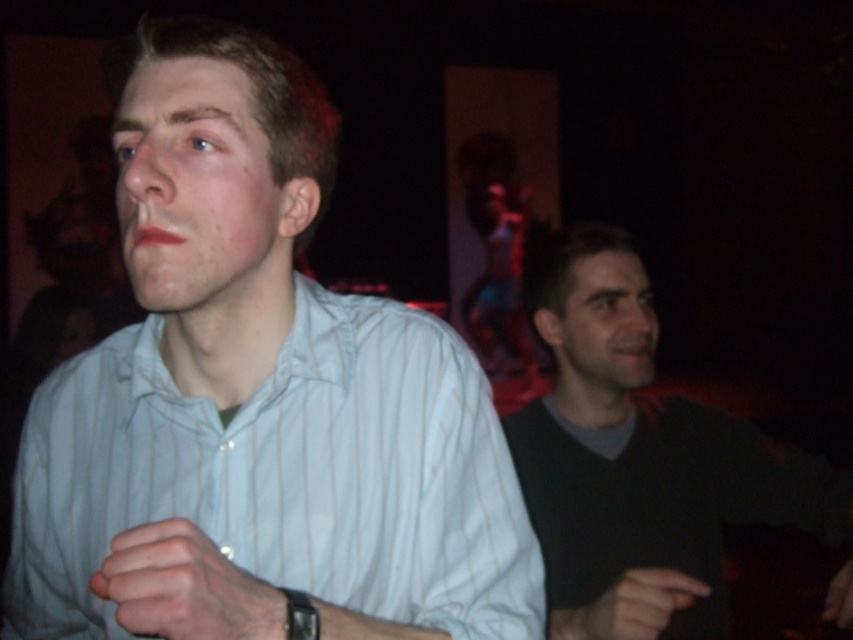
Question: Estimate the real-world distances between objects in this image. Which object is farther from the black rubber wristband at lower center?

Choices:
 (A) dark gray sweater at right
 (B) white striped shirt at center

Answer: (A)

Question: Can you confirm if dark gray sweater at right is thinner than smooth skin hand at lower right?

Choices:
 (A) yes
 (B) no

Answer: (B)

Question: Does dark gray sweater at right lie in front of black rubber wristband at lower center?

Choices:
 (A) no
 (B) yes

Answer: (A)

Question: Which point is farther from the camera taking this photo?

Choices:
 (A) (576, 612)
 (B) (582, 284)

Answer: (B)

Question: Which point appears closest to the camera in this image?

Choices:
 (A) (585, 634)
 (B) (202, 584)
 (C) (654, 428)

Answer: (B)

Question: Is white striped shirt at center closer to camera compared to smooth skin hand at lower right?

Choices:
 (A) no
 (B) yes

Answer: (B)